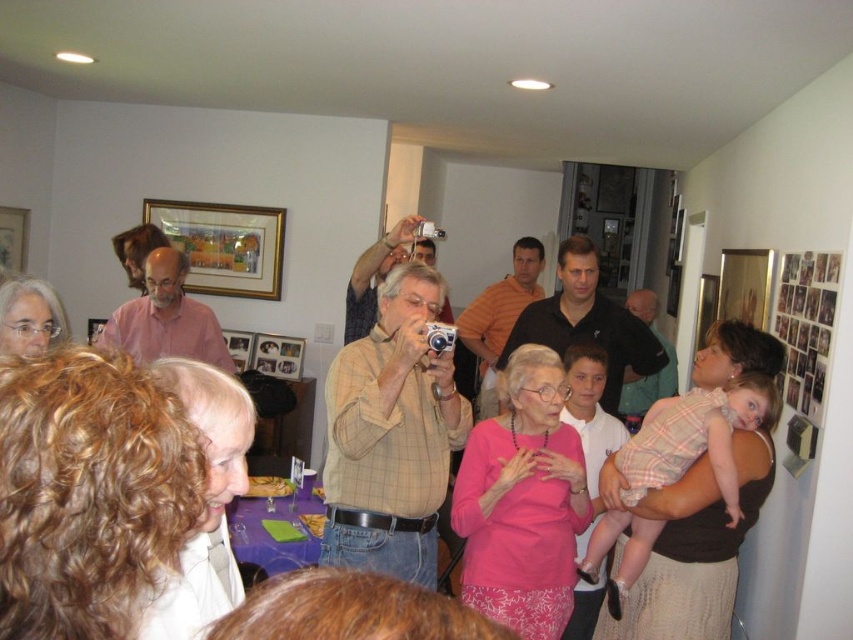
You are organizing a photo shoot in this room and need to position two shirts for a display. The black shirt at center and the pink shirt at center must be placed on a rack. Which shirt should you choose if you want the one that is bigger to be placed higher on the rack?

The black shirt at center has a larger size compared to the pink shirt at center, so you should place the black shirt at center higher on the rack.

You are standing at the center of the room and want to take a photo of the white shirt at lower left. Which direction should you move to get a better angle?

The white shirt at lower left is located at point 0.784 on the x axis and 0.242 on the y axis. Since you are at the center, moving towards the lower left direction would allow you to get a better angle.

You are a photographer standing at the back of the room. You want to take a photo of both the matte pink blouse at center and the light brown shirt at center. The camera you are using has a maximum focus range of 5 feet. Can you capture both subjects in focus without moving closer?

The matte pink blouse at center is 5.40 feet away from the light brown shirt at center. Since the camera can only focus up to 5 feet, the distance between them exceeds the focus range. Therefore, you cannot capture both in focus without moving closer.